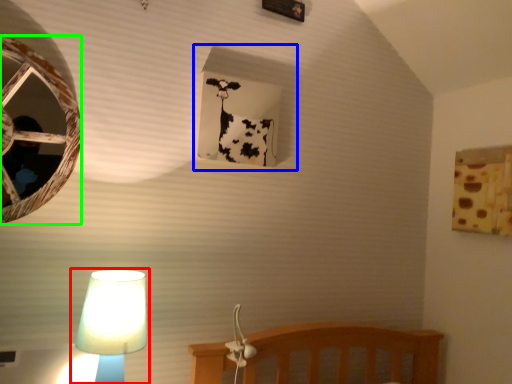
Question: Considering the real-world distances, which object is farthest from lamp (highlighted by a red box)? window frame (highlighted by a blue box) or oval (highlighted by a green box)?

Choices:
 (A) window frame
 (B) oval

Answer: (A)